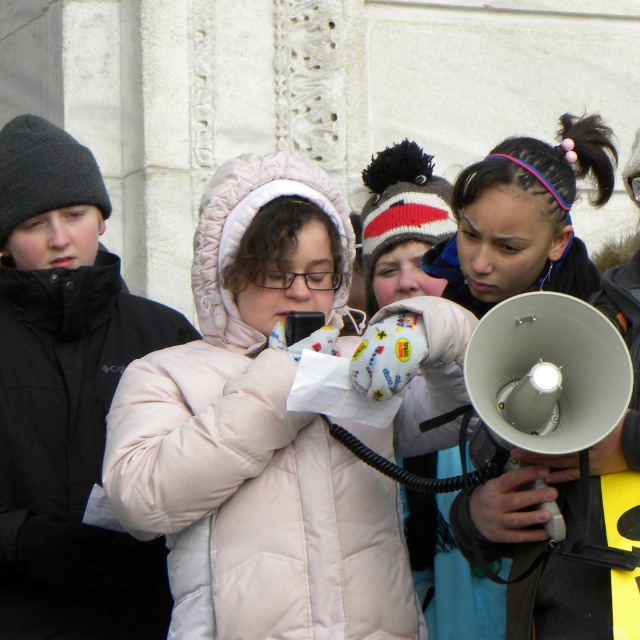
You are a photographer trying to capture the person in the white puffy coat at center without including the matte gray megaphone at center in the shot. Based on their positions, is this possible?

The white puffy coat at center is positioned under the matte gray megaphone at center, so moving the camera angle slightly downward might allow capturing the person without the megaphone.

You are a photographer trying to capture a clear shot of the white puffy coat at center and the matte gray megaphone at center. Which object should you focus on first if you want to ensure both are in frame without adjusting your camera angle?

The white puffy coat at center is not as tall as the matte gray megaphone at center, so you should focus on the matte gray megaphone at center first to ensure it fits within the frame since it is taller.

You are standing in the crowd and want to move from point A to point B. Point A is at coordinate point (241, 316) and point B is at coordinate point (564, 266). Since you want to avoid getting too close to the front of the crowd, which point should you choose as your starting position?

Point (564, 266) is further away from the viewer than point (241, 316), so you should choose point (564, 266) as your starting position to avoid being too close to the front of the crowd.